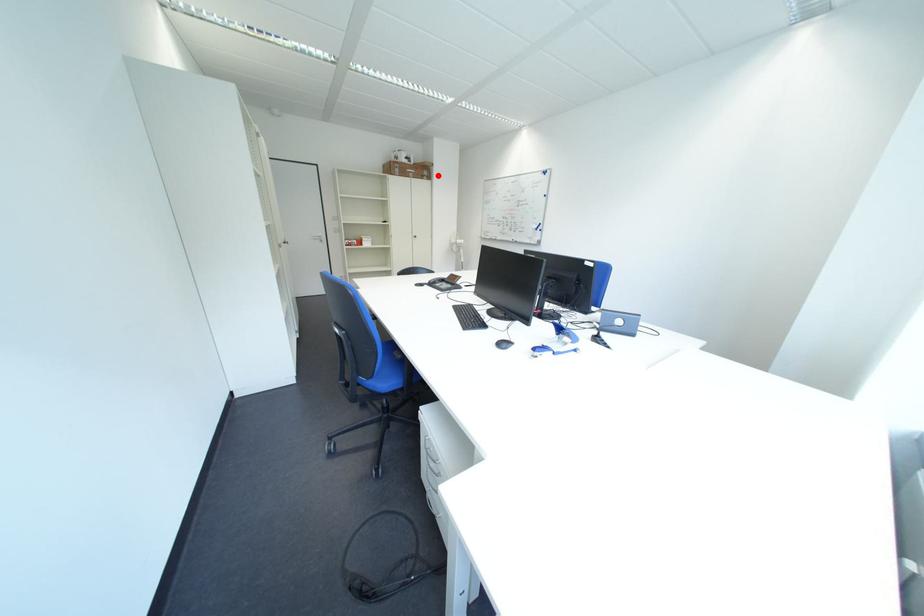
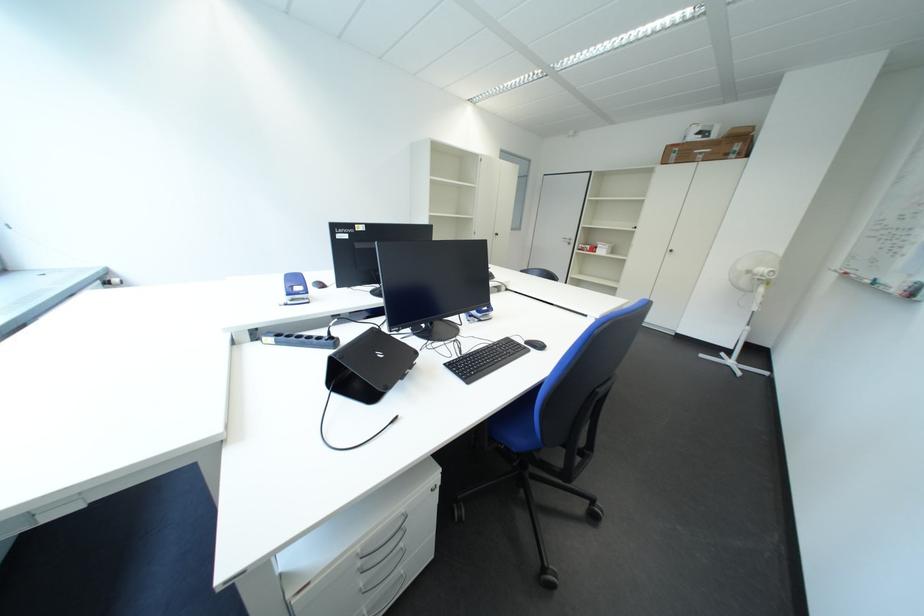
The point at the highlighted location is marked in the first image. Where is the corresponding point in the second image?

(748, 150)